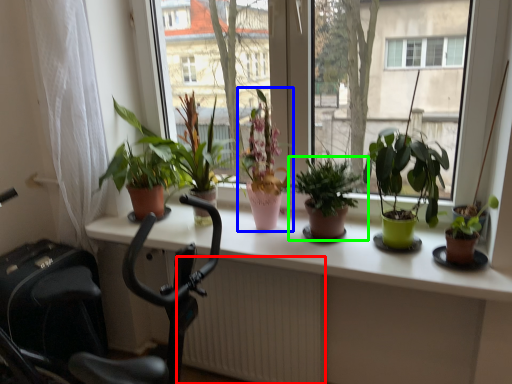
Question: Considering the real-world distances, which object is closest to radiator (highlighted by a red box)? houseplant (highlighted by a blue box) or houseplant (highlighted by a green box).

Choices:
 (A) houseplant
 (B) houseplant

Answer: (A)